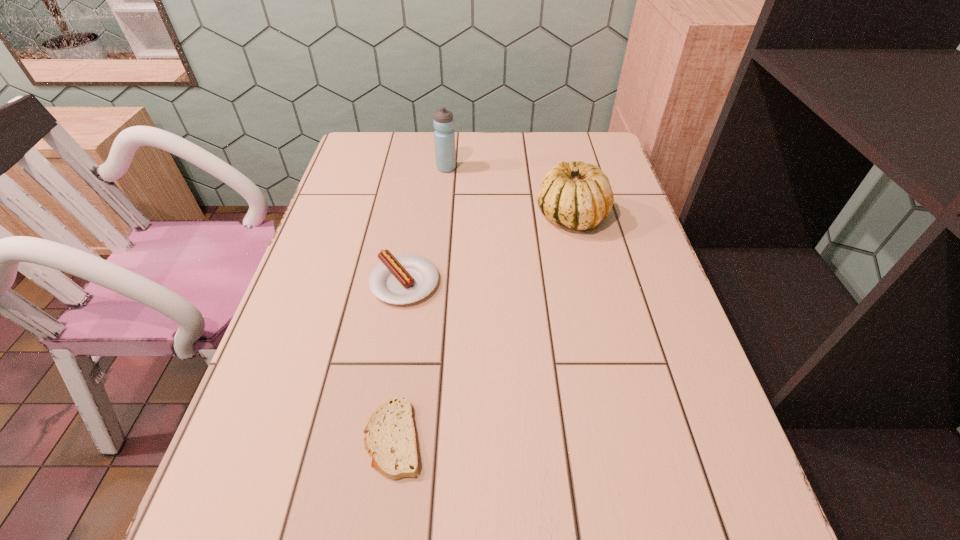
In order to click on the tallest object in this screenshot , I will do 444,136.

I want to click on the farthest object, so click(444, 136).

Find the location of a particular element. the rightmost object is located at coordinates (578, 195).

At what (x,y) coordinates should I click in order to perform the action: click on the third shortest object. Please return your answer as a coordinate pair (x, y). Looking at the image, I should click on (578, 195).

Where is `the third tallest object`? the third tallest object is located at coordinates (407, 278).

Find the location of a particular element. the third farthest object is located at coordinates (407, 278).

The image size is (960, 540). What are the coordinates of `the nearest object` in the screenshot? It's located at (390, 439).

You are a GUI agent. You are given a task and a screenshot of the screen. Output one action in this format:
    pyautogui.click(x=<x>, y=<y>)
    Task: Click on the shortest object
    This screenshot has width=960, height=540.
    Given the screenshot: What is the action you would take?
    pyautogui.click(x=390, y=439)

Identify the location of free space located 0.210m on the front of the water bottle. This screenshot has width=960, height=540. (442, 217).

Where is `vacant space located on the front of the gourd`? vacant space located on the front of the gourd is located at coordinates (597, 331).